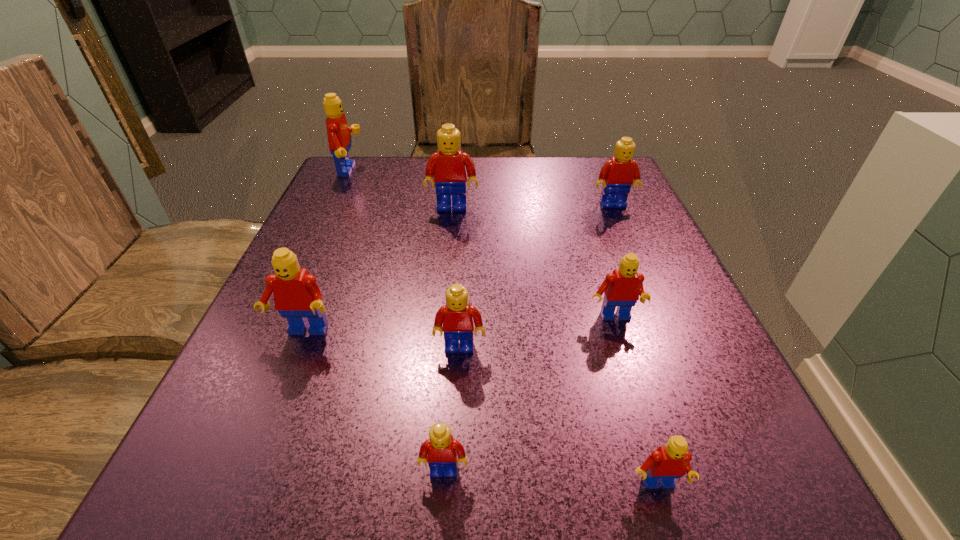
This screenshot has width=960, height=540. In the image, there is a desktop. What are the coordinates of `vacant space at the left edge` in the screenshot? It's located at click(x=369, y=236).

What are the coordinates of `free spot at the right edge of the desktop` in the screenshot? It's located at (617, 209).

Identify the location of free space at the far left corner. The width and height of the screenshot is (960, 540). (356, 176).

In the image, there is a desktop. In order to click on free region at the near left corner in this screenshot , I will do `click(286, 463)`.

At what (x,y) coordinates should I click in order to perform the action: click on free region at the far right corner of the desktop. Please return your answer as a coordinate pair (x, y). This screenshot has width=960, height=540. Looking at the image, I should click on (597, 171).

This screenshot has width=960, height=540. Find the location of `free spot between the second biggest yellow Lego and the nearest red Lego`. free spot between the second biggest yellow Lego and the nearest red Lego is located at coordinates (635, 346).

Find the location of `free space between the farthest red Lego and the third biggest yellow Lego`. free space between the farthest red Lego and the third biggest yellow Lego is located at coordinates (405, 259).

Locate an element on the screen. Image resolution: width=960 pixels, height=540 pixels. free spot between the smallest yellow Lego and the third farthest yellow Lego is located at coordinates (452, 409).

Image resolution: width=960 pixels, height=540 pixels. Identify the location of free point between the smallest red Lego and the biggest yellow Lego. (554, 347).

Identify the location of empty space that is in between the third biggest red Lego and the nearest yellow Lego. (529, 394).